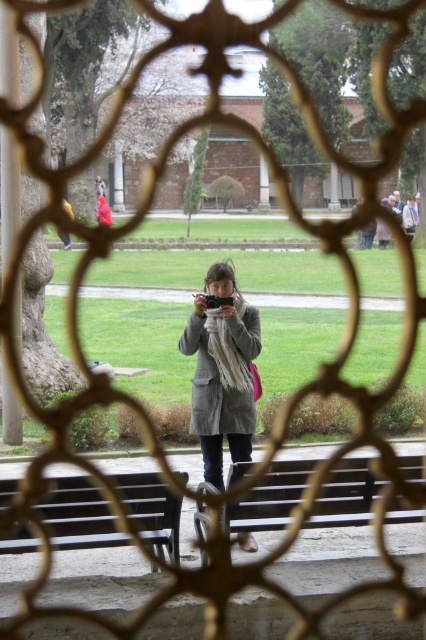
What is the 2D coordinate of the wooden bench at center in the image?

The wooden bench at center is located at the 2D coordinate point of (268, 499).

You are a fashion designer observing the matte gray coat at center and the knitted beige scarf at center. Which clothing item has a greater width?

The matte gray coat at center has a greater width than the knitted beige scarf at center according to the description.

You are a photographer standing on the stone platform and want to take a photo of both the wooden bench at center and the dark brown wooden bench at lower left. Which bench should you adjust your camera angle to focus on first if you want to include both in the frame without moving your position?

You should focus on the wooden bench at center first because it is closer to you than the dark brown wooden bench at lower left. By focusing on the closer bench, you can ensure both are in the frame without needing to move.